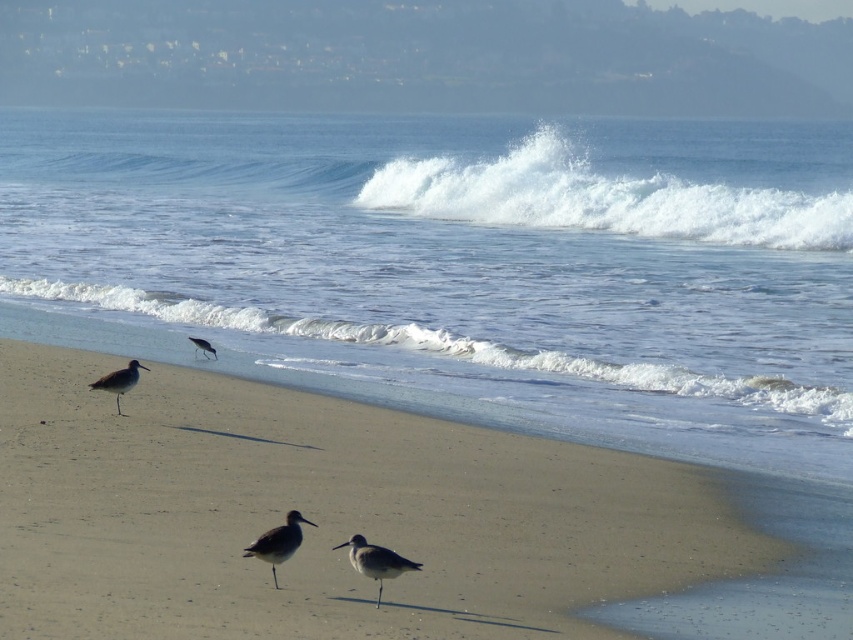
You are standing on the beach and want to walk towards the clear blue water at center and the white foamy wave at lower center. Which one will you reach first?

You will reach the clear blue water at center first because it is closer to the viewer than the white foamy wave at lower center.